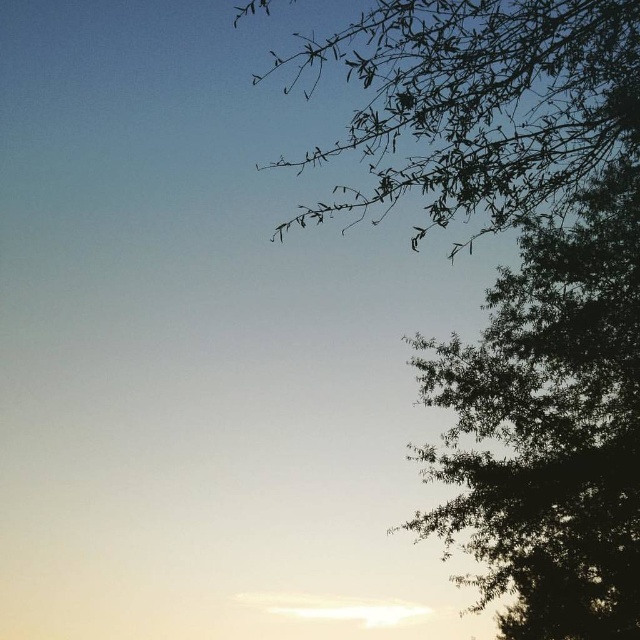
Based on the photo, does green leafy tree at upper right have a lesser width compared to silhouette branches at upper right?

Indeed, green leafy tree at upper right has a lesser width compared to silhouette branches at upper right.

In order to click on green leafy tree at upper right in this screenshot , I will do `click(550, 426)`.

In the scene shown: Who is more forward, (637, 209) or (456, 100)?

Positioned in front is point (456, 100).

The width and height of the screenshot is (640, 640). In order to click on green leafy tree at upper right in this screenshot , I will do `click(550, 426)`.

Who is positioned more to the left, silhouette leafy branch at upper right or green leafy tree at upper right?

silhouette leafy branch at upper right

Can you confirm if silhouette leafy branch at upper right is smaller than green leafy tree at upper right?

Actually, silhouette leafy branch at upper right might be larger than green leafy tree at upper right.

Which is behind, point (576, 516) or point (593, 509)?

Positioned behind is point (576, 516).

Find the location of a particular element. Image resolution: width=640 pixels, height=640 pixels. silhouette leafy branch at upper right is located at coordinates (518, 282).

Does silhouette leafy branch at upper right appear over silhouette branches at upper right?

No, silhouette leafy branch at upper right is not above silhouette branches at upper right.

How distant is silhouette leafy branch at upper right from silhouette branches at upper right?

silhouette leafy branch at upper right and silhouette branches at upper right are 39.09 inches apart.

Find the location of a particular element. The height and width of the screenshot is (640, 640). silhouette leafy branch at upper right is located at coordinates (518, 282).

Image resolution: width=640 pixels, height=640 pixels. I want to click on silhouette leafy branch at upper right, so click(x=518, y=282).